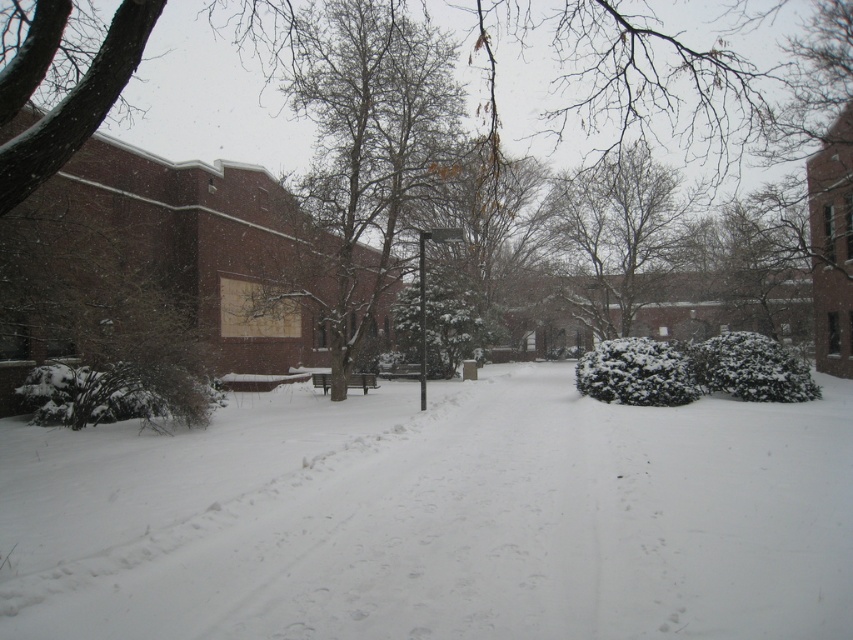
Question: Estimate the real-world distances between objects in this image. Which object is farther from the metallic pole at center?

Choices:
 (A) white fluffy snow at center
 (B) snow-covered tree at center
 (C) snow-covered branches at upper center

Answer: (C)

Question: Among these points, which one is nearest to the camera?

Choices:
 (A) (642, 216)
 (B) (419, 314)

Answer: (B)

Question: Is snow-covered branches at upper center positioned before metallic pole at center?

Choices:
 (A) yes
 (B) no

Answer: (B)

Question: Does white fluffy snow at center appear under metallic pole at center?

Choices:
 (A) yes
 (B) no

Answer: (A)

Question: Which point is farther to the camera?

Choices:
 (A) (369, 84)
 (B) (680, 224)
 (C) (419, 307)

Answer: (B)

Question: Is snow-covered tree at center thinner than metallic pole at center?

Choices:
 (A) no
 (B) yes

Answer: (A)